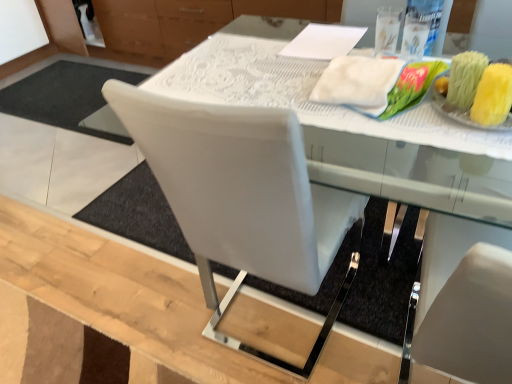
You are a GUI agent. You are given a task and a screenshot of the screen. Output one action in this format:
    pyautogui.click(x=<x>, y=<y>)
    Task: Click on the vacant space situated above white lace tablecloth at center (from a real-world perspective)
    This screenshot has height=384, width=512.
    Given the screenshot: What is the action you would take?
    pyautogui.click(x=282, y=70)